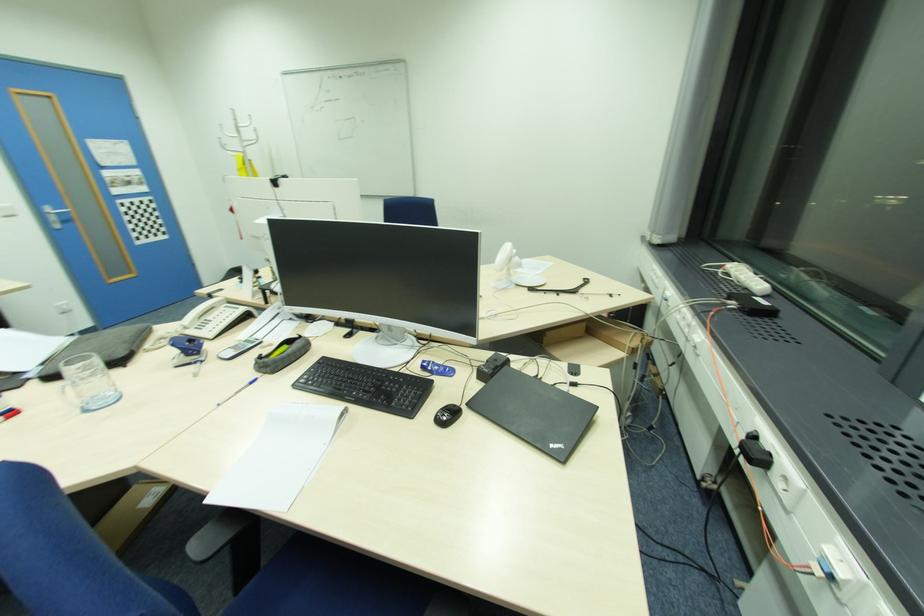
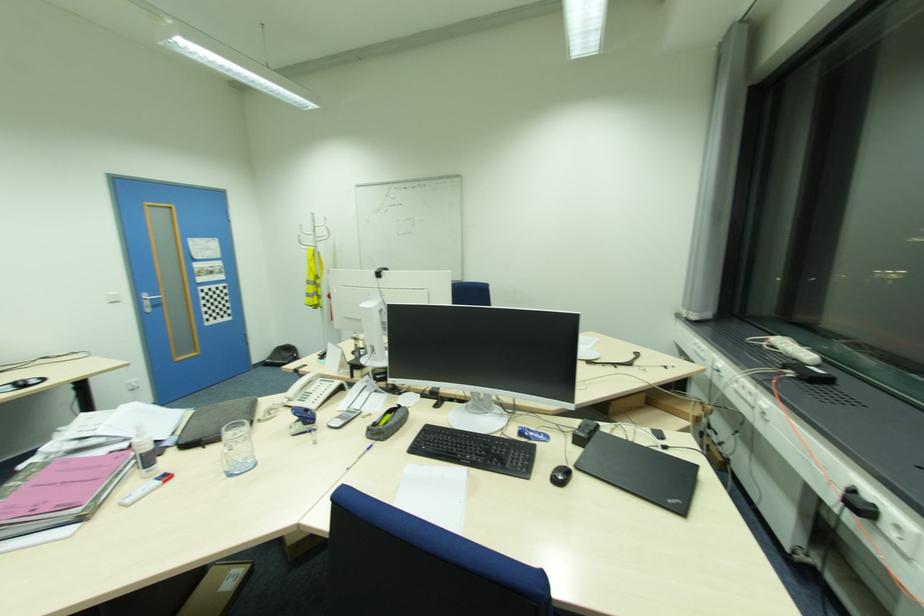
In the second image, find the point that corresponds to pixel 250 124 in the first image.

(330, 225)